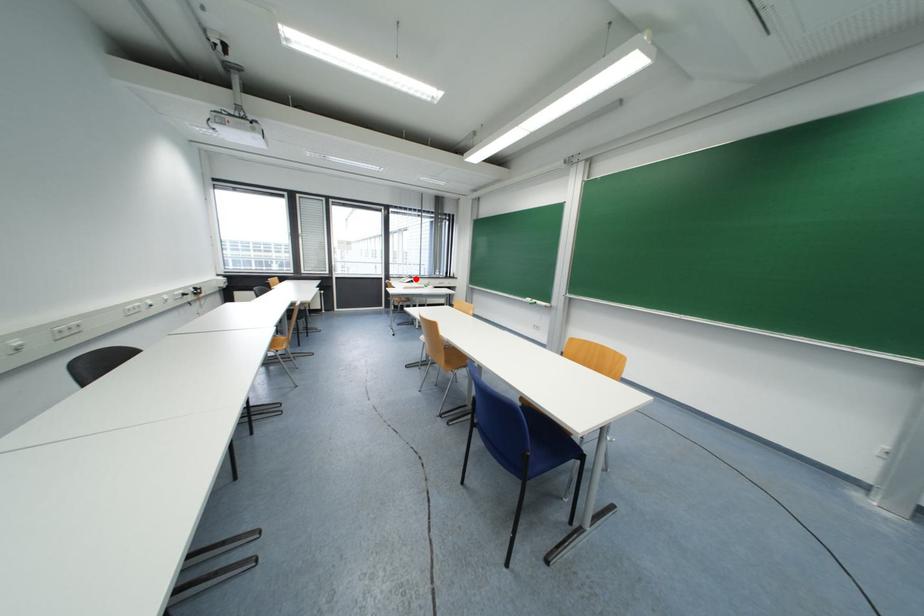
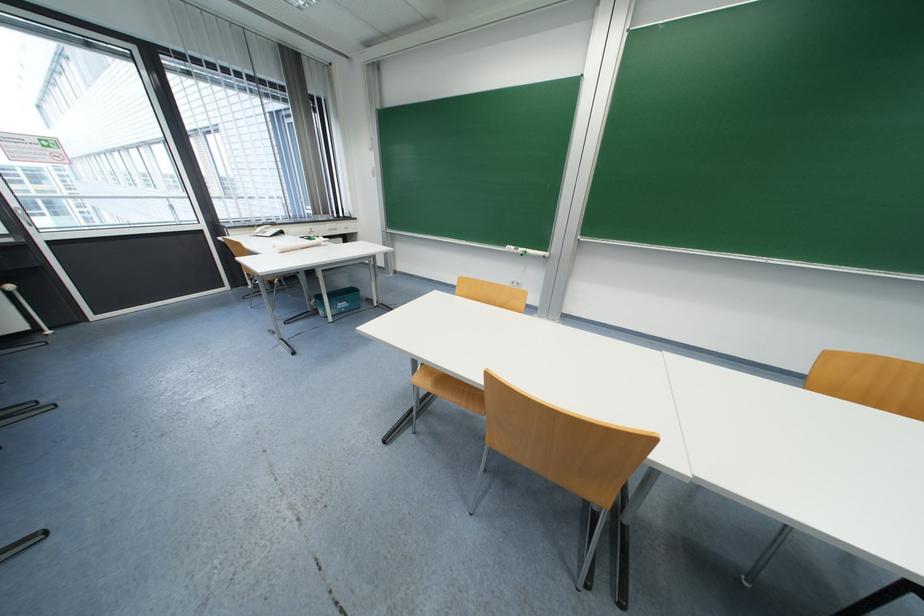
Locate, in the second image, the point that corresponds to the highlighted location in the first image.

(277, 225)